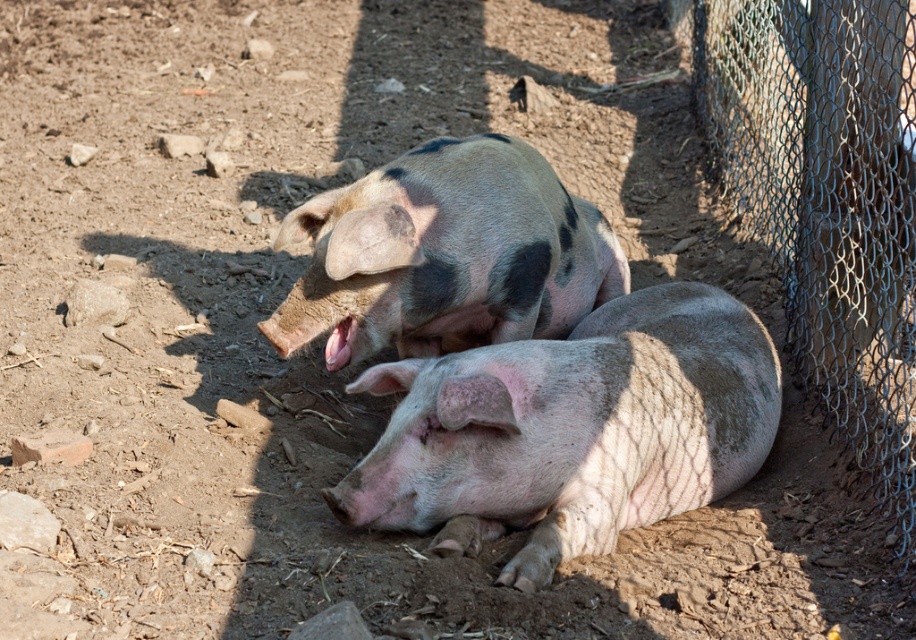
Question: Is pink textured skin at center above speckled pink pig at center?

Choices:
 (A) no
 (B) yes

Answer: (A)

Question: Does pink textured skin at center have a smaller size compared to speckled pink pig at center?

Choices:
 (A) yes
 (B) no

Answer: (A)

Question: Estimate the real-world distances between objects in this image. Which object is farther from the speckled pink pig at center?

Choices:
 (A) pink textured skin at center
 (B) wire mesh fence at right

Answer: (B)

Question: Observing the image, what is the correct spatial positioning of wire mesh fence at right in reference to speckled pink pig at center?

Choices:
 (A) right
 (B) left

Answer: (A)

Question: Which point is farther from the camera taking this photo?

Choices:
 (A) (541, 445)
 (B) (493, 168)

Answer: (B)

Question: Estimate the real-world distances between objects in this image. Which object is farther from the speckled pink pig at center?

Choices:
 (A) wire mesh fence at right
 (B) pink textured skin at center

Answer: (A)